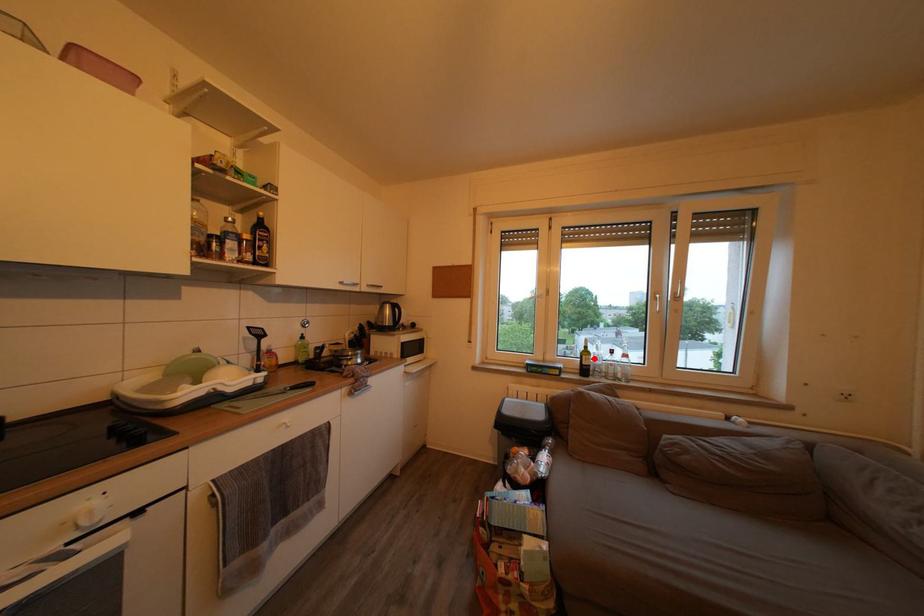
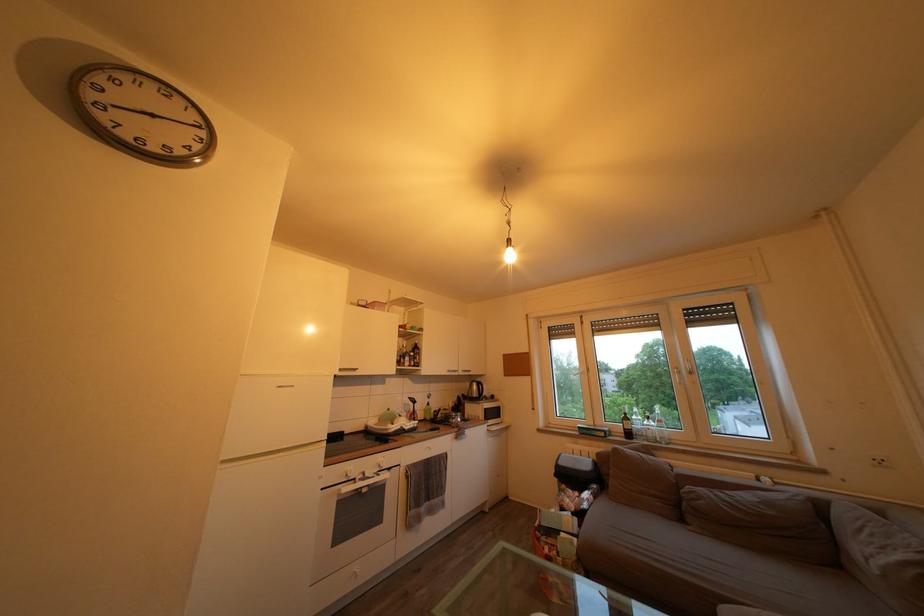
Where in the second image is the point corresponding to the highlighted location from the first image?

(635, 424)